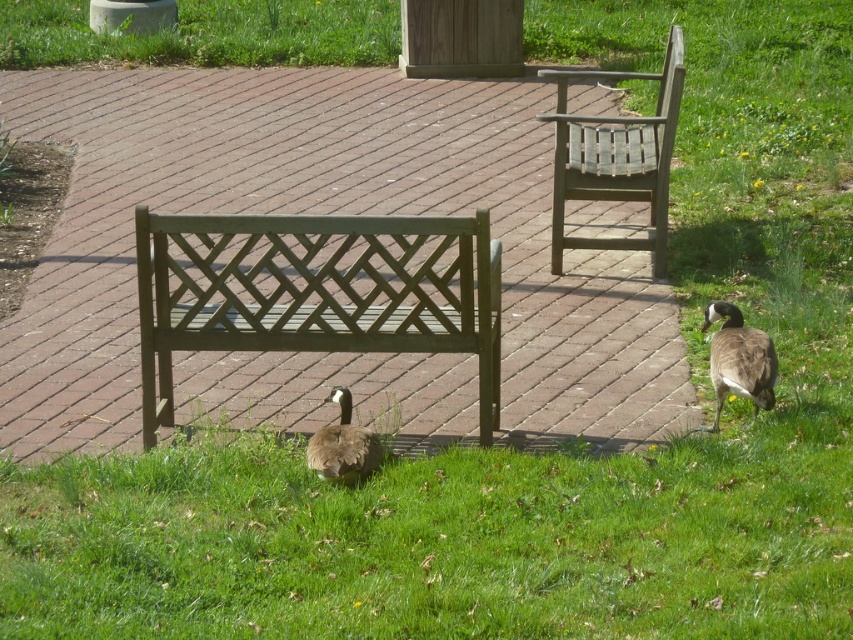
Does matte green bench at center have a lesser height compared to brown feathered duck at lower right?

No.

Who is more distant from viewer, (x=152, y=291) or (x=732, y=317)?

The point (x=732, y=317) is more distant.

Locate an element on the screen. The height and width of the screenshot is (640, 853). matte green bench at center is located at coordinates (315, 292).

Which is below, green grass at lower center or brown matte duck at lower center?

green grass at lower center

Can you confirm if green grass at lower center is thinner than brown matte duck at lower center?

Incorrect, green grass at lower center's width is not less than brown matte duck at lower center's.

Does point (390, 634) lie behind point (315, 460)?

No, it is not.

You are a GUI agent. You are given a task and a screenshot of the screen. Output one action in this format:
    pyautogui.click(x=<x>, y=<y>)
    Task: Click on the green grass at lower center
    The image size is (853, 640).
    Given the screenshot: What is the action you would take?
    pyautogui.click(x=440, y=540)

Can you confirm if wooden lattice bench at upper right is smaller than brown feathered duck at lower right?

Incorrect, wooden lattice bench at upper right is not smaller in size than brown feathered duck at lower right.

Is point (576, 240) positioned before point (759, 346)?

No, it is behind (759, 346).

Locate an element on the screen. The width and height of the screenshot is (853, 640). wooden lattice bench at upper right is located at coordinates (616, 156).